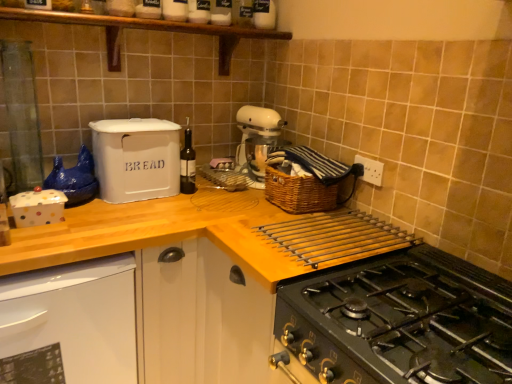
Question: Is white matte bread bin at upper left outside dark glass bottle at center?

Choices:
 (A) no
 (B) yes

Answer: (B)

Question: Is white matte bread bin at upper left oriented away from dark glass bottle at center?

Choices:
 (A) no
 (B) yes

Answer: (A)

Question: Considering the relative positions of white matte bread bin at upper left and dark glass bottle at center in the image provided, is white matte bread bin at upper left to the left of dark glass bottle at center from the viewer's perspective?

Choices:
 (A) yes
 (B) no

Answer: (A)

Question: From a real-world perspective, is white matte bread bin at upper left located higher than dark glass bottle at center?

Choices:
 (A) no
 (B) yes

Answer: (B)

Question: Is white matte bread bin at upper left closer to the viewer compared to dark glass bottle at center?

Choices:
 (A) yes
 (B) no

Answer: (A)

Question: From the image's perspective, is white matte bread bin at upper left on dark glass bottle at center?

Choices:
 (A) no
 (B) yes

Answer: (B)

Question: Is white glossy dishwasher at lower left located within dark glass bottle at center?

Choices:
 (A) no
 (B) yes

Answer: (A)

Question: Are dark glass bottle at center and white glossy dishwasher at lower left far apart?

Choices:
 (A) no
 (B) yes

Answer: (A)

Question: From the image's perspective, would you say dark glass bottle at center is positioned over white glossy dishwasher at lower left?

Choices:
 (A) yes
 (B) no

Answer: (A)

Question: Considering the relative positions of dark glass bottle at center and white glossy dishwasher at lower left in the image provided, is dark glass bottle at center to the left of white glossy dishwasher at lower left from the viewer's perspective?

Choices:
 (A) no
 (B) yes

Answer: (A)

Question: Considering the relative positions of dark glass bottle at center and white glossy dishwasher at lower left in the image provided, is dark glass bottle at center in front of white glossy dishwasher at lower left?

Choices:
 (A) yes
 (B) no

Answer: (B)

Question: Can you confirm if dark glass bottle at center is wider than white glossy dishwasher at lower left?

Choices:
 (A) no
 (B) yes

Answer: (A)

Question: Considering the relative sizes of woven brown basket at upper right and wooden at upper center in the image provided, is woven brown basket at upper right shorter than wooden at upper center?

Choices:
 (A) no
 (B) yes

Answer: (B)